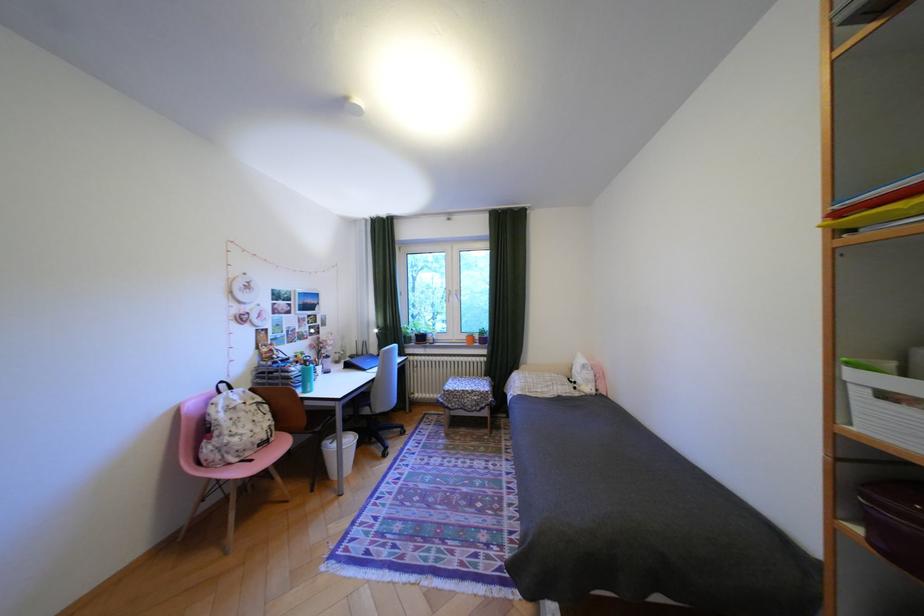
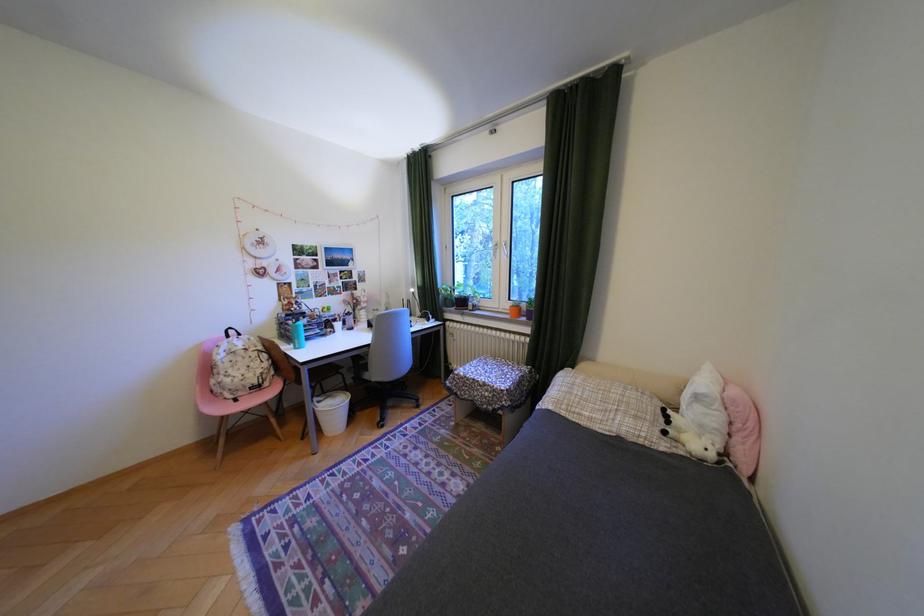
The point at [609,390] is marked in the first image. Where is the corresponding point in the second image?

(736, 455)